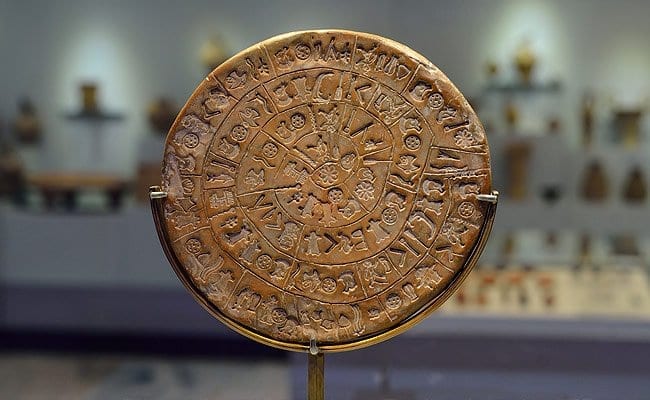
You are a GUI agent. You are given a task and a screenshot of the screen. Output one action in this format:
    pyautogui.click(x=<x>, y=<y>)
    Task: Click on the brackets holding piece in frame
    This screenshot has width=650, height=400.
    Given the screenshot: What is the action you would take?
    pyautogui.click(x=156, y=195), pyautogui.click(x=489, y=201)